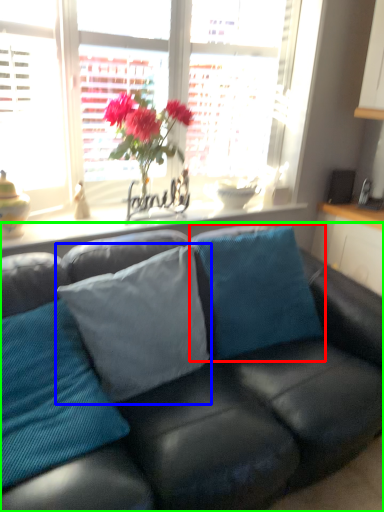
Question: Considering the real-world distances, which object is closest to pillow (highlighted by a red box)? pillow (highlighted by a blue box) or studio couch (highlighted by a green box).

Choices:
 (A) pillow
 (B) studio couch

Answer: (B)